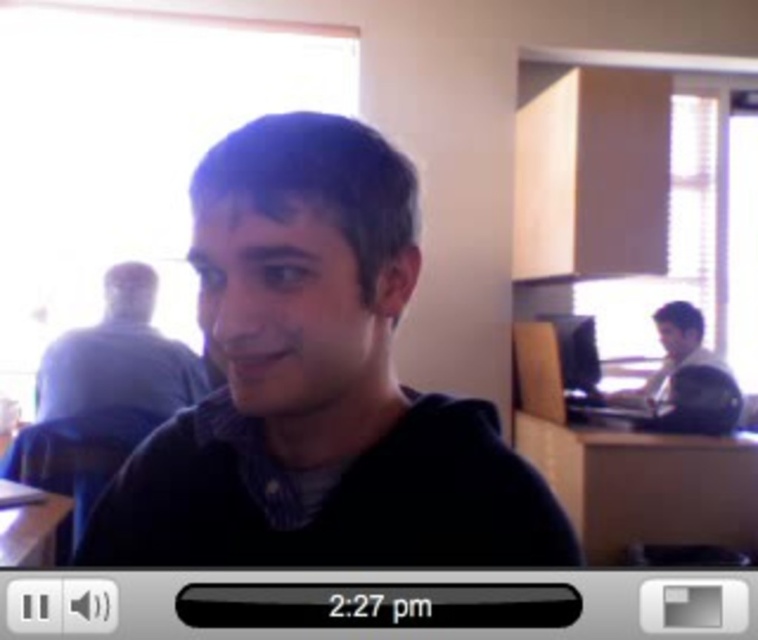
The width and height of the screenshot is (758, 640). Describe the element at coordinates (644, 484) in the screenshot. I see `wooden desk at center` at that location.

Does wooden desk at center have a smaller size compared to light brown wooden desk at right?

Incorrect, wooden desk at center is not smaller in size than light brown wooden desk at right.

The image size is (758, 640). In order to click on wooden desk at center in this screenshot , I will do `click(644, 484)`.

Can you confirm if gray matte shirt at upper left is positioned to the right of matte black monitor at right?

No, gray matte shirt at upper left is not to the right of matte black monitor at right.

Which is in front, point (58, 381) or point (567, 380)?

Point (58, 381) is in front.

I want to click on gray matte shirt at upper left, so click(x=118, y=356).

Who is positioned more to the right, wooden table at lower left or matte black monitor at right?

matte black monitor at right is more to the right.

Is wooden table at lower left further to the viewer compared to matte black monitor at right?

No.

Does point (45, 554) come farther from viewer compared to point (540, 316)?

No, (45, 554) is in front of (540, 316).

Identify the location of wooden table at lower left. This screenshot has width=758, height=640. (27, 524).